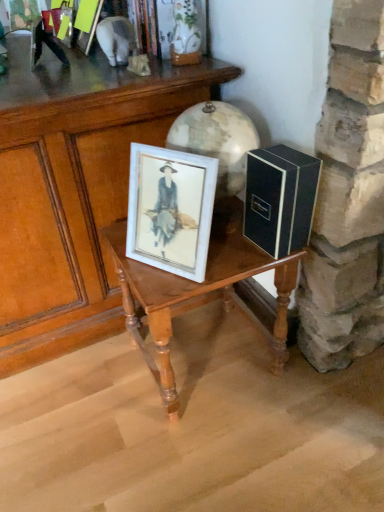
Where is `vacant space situated on the left part of black matte box at right`? This screenshot has height=512, width=384. vacant space situated on the left part of black matte box at right is located at coordinates (221, 260).